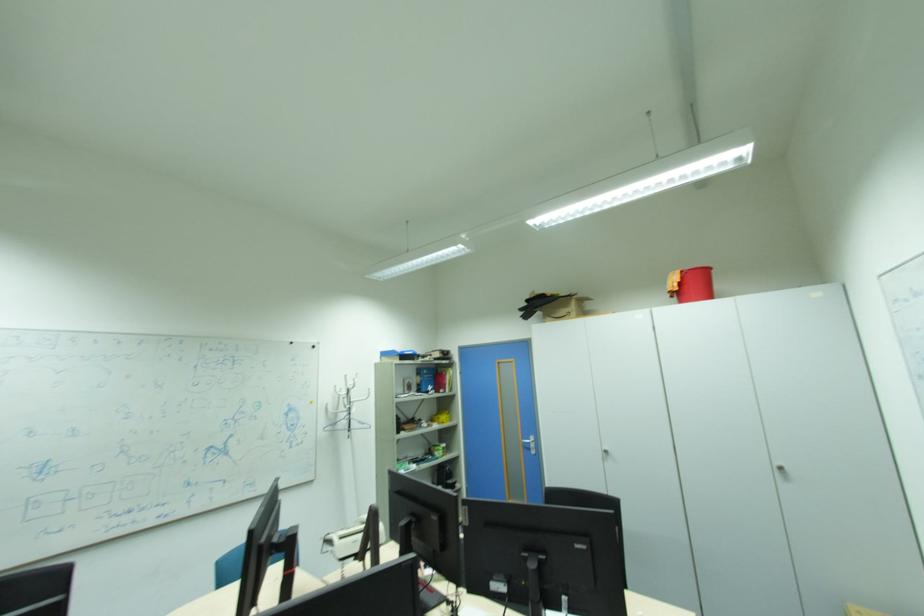
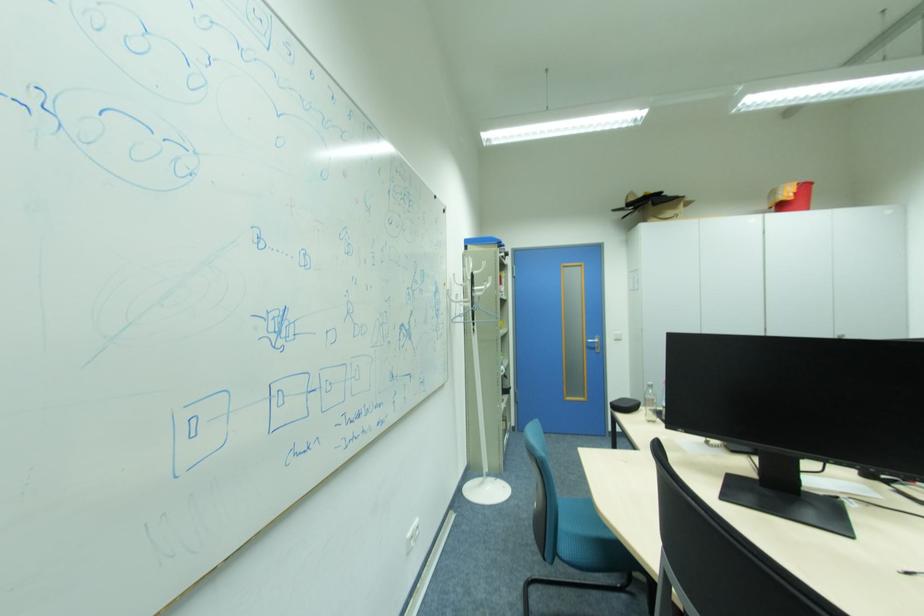
The images are taken continuously from a first-person perspective. In which direction are you moving?

The movement direction of the cameraman is left, forward.